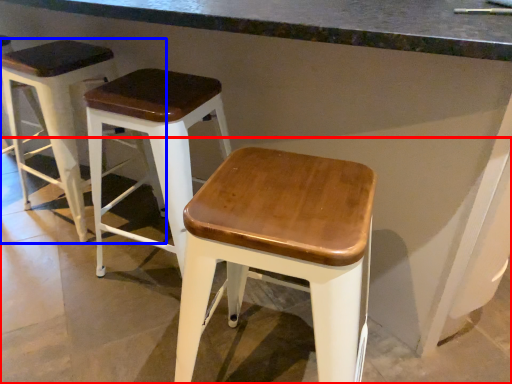
Question: Which point is further to the camera, concrete (highlighted by a red box) or stool (highlighted by a blue box)?

Choices:
 (A) concrete
 (B) stool

Answer: (B)